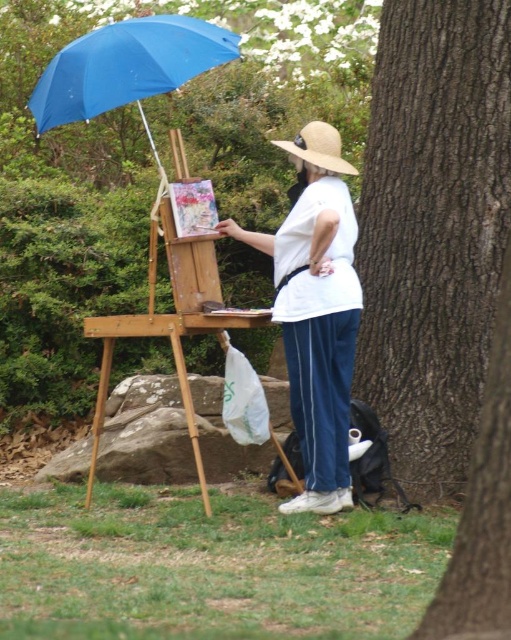
Question: Is brown rough bark tree at right to the right of straw hat at upper center from the viewer's perspective?

Choices:
 (A) yes
 (B) no

Answer: (A)

Question: Which object is positioned farthest from the straw hat at upper center?

Choices:
 (A) brown rough bark tree at right
 (B) white cotton shirt at center

Answer: (A)

Question: Does brown rough bark tree at right come behind blue fabric umbrella at upper left?

Choices:
 (A) no
 (B) yes

Answer: (B)

Question: Among these objects, which one is nearest to the camera?

Choices:
 (A) blue fabric umbrella at upper left
 (B) white cotton shirt at center

Answer: (A)

Question: Can you confirm if brown rough bark tree at right is positioned to the right of wooden easel at center?

Choices:
 (A) no
 (B) yes

Answer: (B)

Question: Among these objects, which one is nearest to the camera?

Choices:
 (A) straw hat at upper center
 (B) white cotton shirt at center
 (C) wooden easel at center
 (D) brown rough bark tree at right

Answer: (C)